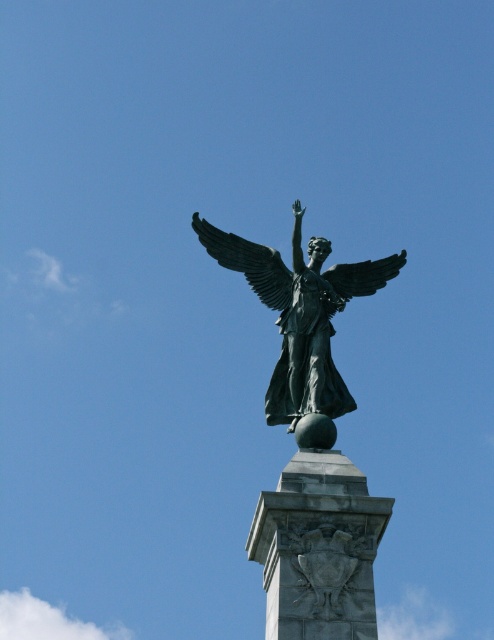
Is bronze statue at center shorter than bronze wing at upper center?

In fact, bronze statue at center may be taller than bronze wing at upper center.

This screenshot has height=640, width=494. Identify the location of bronze statue at center. (300, 314).

Is point (315, 282) less distant than point (393, 266)?

Yes, it is.

Identify the location of bronze statue at center. This screenshot has height=640, width=494. 300,314.

Who is taller, bronze statue at center or green patina wings at upper center?

Standing taller between the two is bronze statue at center.

Who is more distant from viewer, (280, 285) or (269, 259)?

The point (269, 259) is more distant.

I want to click on bronze statue at center, so [300, 314].

Which is behind, point (218, 250) or point (379, 266)?

The point (379, 266) is behind.

Who is higher up, green patina wings at upper center or bronze wing at upper center?

green patina wings at upper center is higher up.

Identify the location of green patina wings at upper center. (248, 262).

Where is `green patina wings at upper center`? This screenshot has width=494, height=640. green patina wings at upper center is located at coordinates (248, 262).